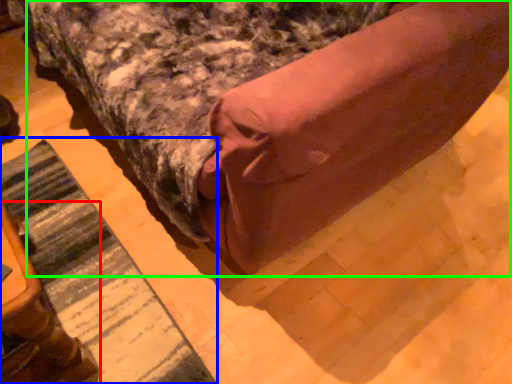
Question: Based on their relative distances, which object is nearer to furniture (highlighted by a red box)? Choose from mat (highlighted by a blue box) and bed (highlighted by a green box).

Choices:
 (A) mat
 (B) bed

Answer: (A)